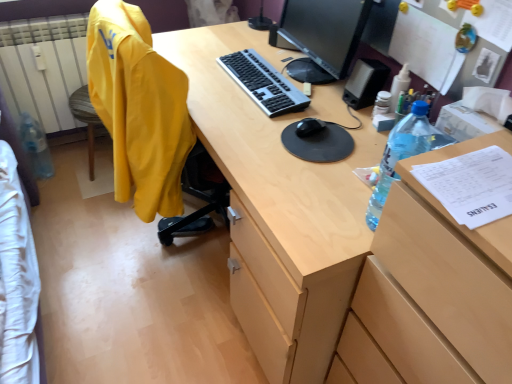
Question: Could you tell me if black matte mouse at center is turned towards silver/black plastic keyboard at center?

Choices:
 (A) no
 (B) yes

Answer: (A)

Question: Would you say black matte mouse at center contains silver/black plastic keyboard at center?

Choices:
 (A) no
 (B) yes

Answer: (A)

Question: Is black matte mouse at center further to camera compared to silver/black plastic keyboard at center?

Choices:
 (A) yes
 (B) no

Answer: (B)

Question: Is black matte mouse at center positioned beyond the bounds of silver/black plastic keyboard at center?

Choices:
 (A) no
 (B) yes

Answer: (B)

Question: Considering the relative sizes of black matte mouse at center and silver/black plastic keyboard at center in the image provided, is black matte mouse at center taller than silver/black plastic keyboard at center?

Choices:
 (A) yes
 (B) no

Answer: (A)

Question: Can you confirm if black matte mouse at center is wider than silver/black plastic keyboard at center?

Choices:
 (A) no
 (B) yes

Answer: (A)

Question: Can you see translucent plastic bottle at right, the 2th bottle from the left, touching wooden file cabinet at right?

Choices:
 (A) yes
 (B) no

Answer: (B)

Question: Does translucent plastic bottle at right, the 2th bottle from the left, have a greater width compared to wooden file cabinet at right?

Choices:
 (A) yes
 (B) no

Answer: (B)

Question: Is translucent plastic bottle at right, the 2th bottle from the left, located outside wooden file cabinet at right?

Choices:
 (A) no
 (B) yes

Answer: (B)

Question: Is translucent plastic bottle at right, which appears as the first bottle when viewed from the front, positioned in front of wooden file cabinet at right?

Choices:
 (A) yes
 (B) no

Answer: (B)

Question: Does translucent plastic bottle at right, which appears as the 2th bottle when viewed from the back, have a smaller size compared to wooden file cabinet at right?

Choices:
 (A) yes
 (B) no

Answer: (A)

Question: From the image's perspective, is translucent plastic bottle at right, the 2th bottle from the left, under wooden file cabinet at right?

Choices:
 (A) no
 (B) yes

Answer: (A)

Question: Is matte wood desk at center shorter than wooden file cabinet at right?

Choices:
 (A) yes
 (B) no

Answer: (A)